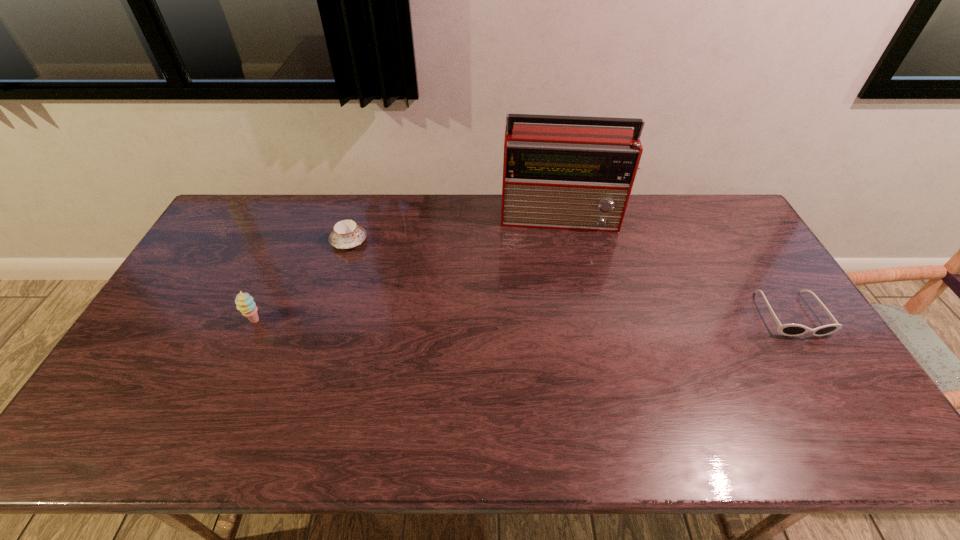
Locate an element on the screen. vacant spot on the desktop that is between the sherbert and the shortest object and is positioned on the front-facing side of the third object from left to right is located at coordinates (568, 317).

You are a GUI agent. You are given a task and a screenshot of the screen. Output one action in this format:
    pyautogui.click(x=<x>, y=<y>)
    Task: Click on the vacant spot on the desktop that is between the second tallest object and the sunglasses and is positioned on the side with the handle of the second shortest object
    The image size is (960, 540).
    Given the screenshot: What is the action you would take?
    pyautogui.click(x=500, y=318)